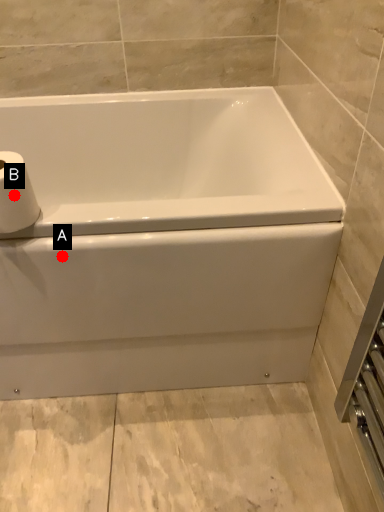
Question: Two points are circled on the image, labeled by A and B beside each circle. Which point is closer to the camera?

Choices:
 (A) A is closer
 (B) B is closer

Answer: (B)